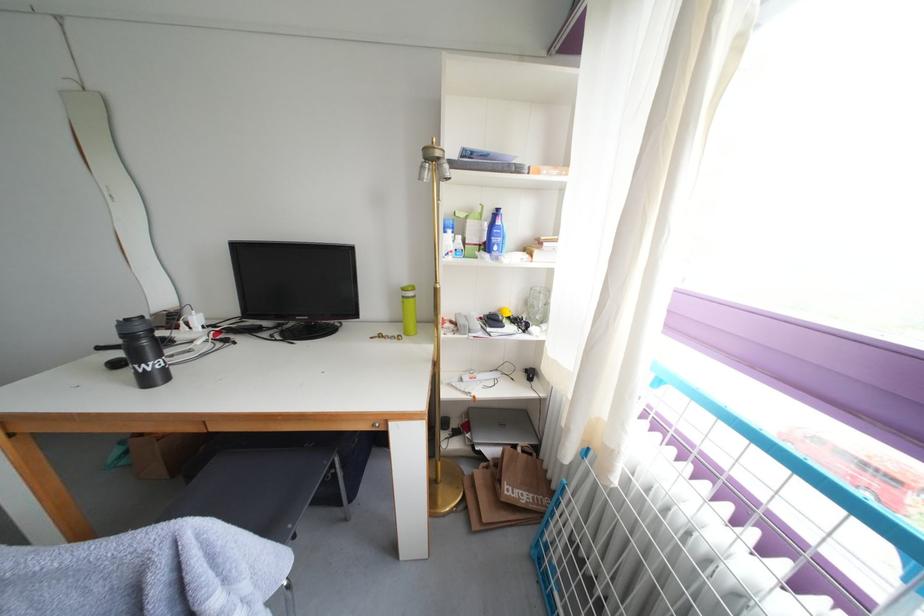
Describe the element at coordinates (147, 573) in the screenshot. I see `the chair sitting surface` at that location.